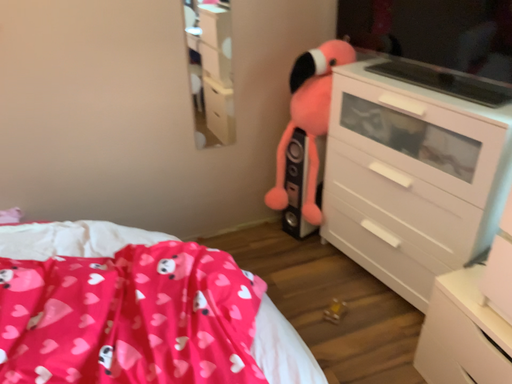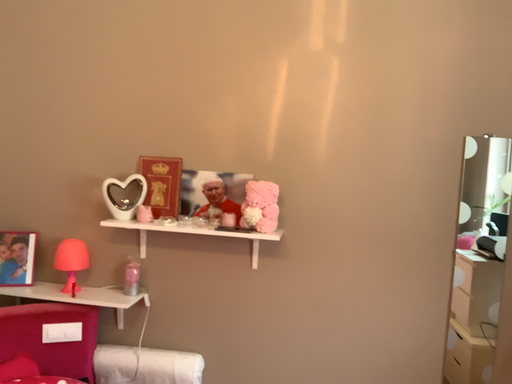
Question: How did the camera likely rotate when shooting the video?

Choices:
 (A) rotated right
 (B) rotated left

Answer: (B)